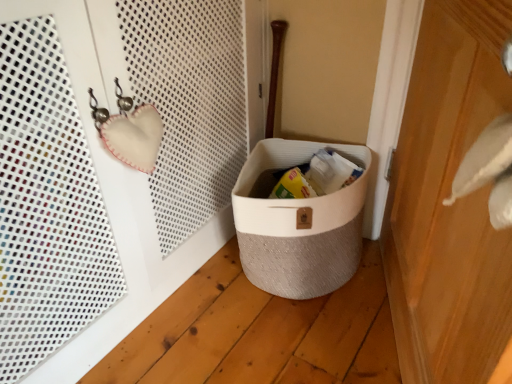
Question: Should I look upward or downward to see wooden door at right?

Choices:
 (A) down
 (B) up

Answer: (A)

Question: From a real-world perspective, is beige textured basket at lower center on top of wooden door at right?

Choices:
 (A) no
 (B) yes

Answer: (A)

Question: Is beige textured basket at lower center completely or partially outside of wooden door at right?

Choices:
 (A) yes
 (B) no

Answer: (A)

Question: Is beige textured basket at lower center turned away from wooden door at right?

Choices:
 (A) yes
 (B) no

Answer: (B)

Question: Can you confirm if beige textured basket at lower center is positioned to the left of wooden door at right?

Choices:
 (A) yes
 (B) no

Answer: (A)

Question: From the image's perspective, would you say beige textured basket at lower center is shown under wooden door at right?

Choices:
 (A) no
 (B) yes

Answer: (B)

Question: Is beige textured basket at lower center shorter than wooden door at right?

Choices:
 (A) yes
 (B) no

Answer: (A)

Question: Is the position of wooden door at right more distant than that of beige textured basket at lower center?

Choices:
 (A) yes
 (B) no

Answer: (B)

Question: From a real-world perspective, is wooden door at right on top of beige textured basket at lower center?

Choices:
 (A) no
 (B) yes

Answer: (B)

Question: From the image's perspective, is wooden door at right on top of beige textured basket at lower center?

Choices:
 (A) yes
 (B) no

Answer: (A)

Question: Does wooden door at right contain beige textured basket at lower center?

Choices:
 (A) yes
 (B) no

Answer: (B)

Question: Does wooden door at right have a greater width compared to beige textured basket at lower center?

Choices:
 (A) yes
 (B) no

Answer: (B)

Question: Is wooden door at right next to beige textured basket at lower center?

Choices:
 (A) no
 (B) yes

Answer: (A)

Question: Is wooden door at right taller or shorter than beige textured basket at lower center?

Choices:
 (A) short
 (B) tall

Answer: (B)